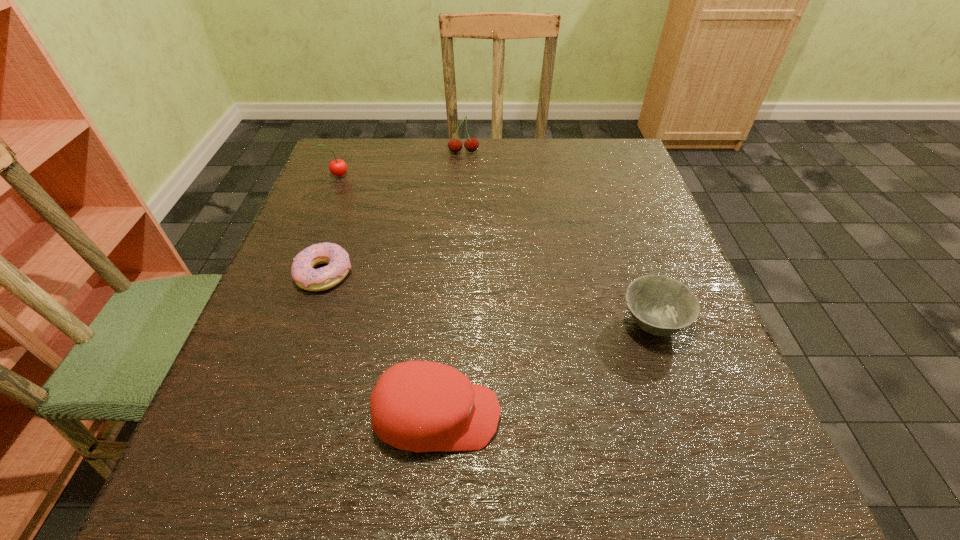
The image size is (960, 540). I want to click on vacant region between the nearer cherry and the third nearest object, so click(x=331, y=225).

This screenshot has width=960, height=540. I want to click on blank region between the farther cherry and the second nearest object, so click(558, 238).

This screenshot has height=540, width=960. I want to click on free spot between the left cherry and the doughnut, so click(331, 225).

Where is `empty space between the shortest object and the nearer cherry`? This screenshot has width=960, height=540. empty space between the shortest object and the nearer cherry is located at coordinates (331, 225).

Image resolution: width=960 pixels, height=540 pixels. In order to click on free space between the doughnut and the farther cherry in this screenshot , I will do `click(394, 213)`.

Locate an element on the screen. The width and height of the screenshot is (960, 540). object identified as the third closest to the fourth farthest object is located at coordinates (471, 144).

Find the location of a particular element. This screenshot has width=960, height=540. object that is the third closest to the shortest object is located at coordinates (471, 144).

In order to click on free space that satisfies the following two spatial constraints: 1. on the surface of the fourth farthest object; 2. on the right side of the right cherry in this screenshot , I will do `click(455, 323)`.

Identify the location of vacant space that satisfies the following two spatial constraints: 1. on the front side of the shortest object; 2. on the left side of the left cherry. The width and height of the screenshot is (960, 540). (299, 273).